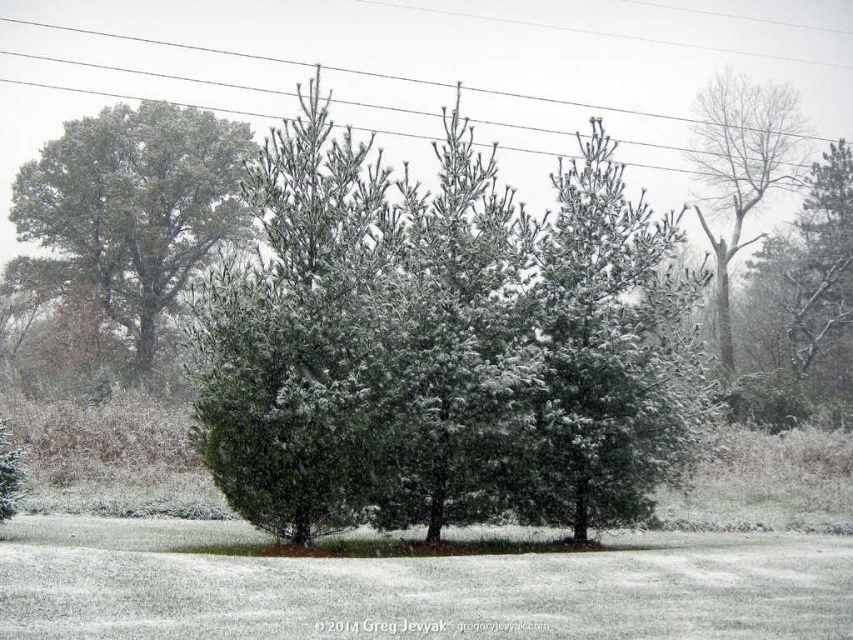
From the picture: Between snow-covered pine tree at center and bare wood tree at upper right, which one has more height?

With more height is snow-covered pine tree at center.

What do you see at coordinates (608, 353) in the screenshot? I see `snow-covered pine tree at center` at bounding box center [608, 353].

Where is `snow-covered pine tree at center`? The width and height of the screenshot is (853, 640). snow-covered pine tree at center is located at coordinates (608, 353).

Image resolution: width=853 pixels, height=640 pixels. Find the location of `snow-covered pine tree at center`. snow-covered pine tree at center is located at coordinates (608, 353).

Is the position of snow-covered pine tree at center less distant than that of metallic wire at upper center?

Yes, it is.

Between point (683, 326) and point (375, 72), which one is positioned behind?

The point (375, 72) is more distant.

The height and width of the screenshot is (640, 853). I want to click on snow-covered pine tree at center, so click(608, 353).

Does green matte evergreen at center appear on the left side of metallic wire at upper center?

Incorrect, green matte evergreen at center is not on the left side of metallic wire at upper center.

In order to click on green matte evergreen at center in this screenshot , I will do `click(444, 342)`.